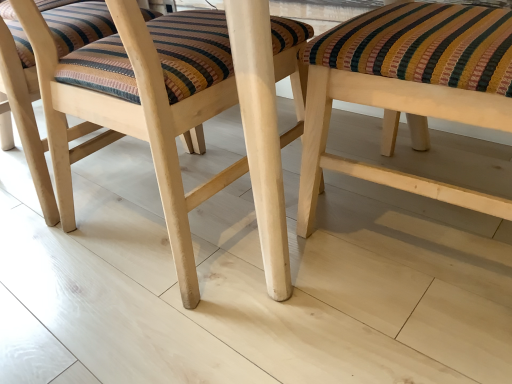
Question: Looking at their shapes, would you say wooden stool at center, placed as the 1th stool when sorted from right to left, is wider or thinner than natural wood stool at center, the 2th stool from the right?

Choices:
 (A) thin
 (B) wide

Answer: (A)

Question: From a real-world perspective, is wooden stool at center, placed as the 1th stool when sorted from right to left, physically located above or below natural wood stool at center, the 1th stool positioned from the left?

Choices:
 (A) above
 (B) below

Answer: (B)

Question: Based on their positions, is wooden stool at center, placed as the 1th stool when sorted from right to left, located to the left or right of natural wood stool at center, the 1th stool positioned from the left?

Choices:
 (A) left
 (B) right

Answer: (B)

Question: Which is correct: natural wood stool at center, the 1th stool positioned from the left, is inside wooden stool at center, placed as the 1th stool when sorted from right to left, or outside of it?

Choices:
 (A) outside
 (B) inside

Answer: (A)

Question: In terms of size, does natural wood stool at center, the 1th stool positioned from the left, appear bigger or smaller than wooden stool at center, placed as the 1th stool when sorted from right to left?

Choices:
 (A) small
 (B) big

Answer: (B)

Question: From a real-world perspective, relative to wooden stool at center, which ranks as the 2th stool in left-to-right order, is natural wood stool at center, the 2th stool from the right, vertically above or below?

Choices:
 (A) below
 (B) above

Answer: (B)

Question: Considering the relative positions of natural wood stool at center, the 2th stool from the right, and wooden stool at center, which ranks as the 2th stool in left-to-right order, in the image provided, is natural wood stool at center, the 2th stool from the right, to the left or to the right of wooden stool at center, which ranks as the 2th stool in left-to-right order,?

Choices:
 (A) left
 (B) right

Answer: (A)